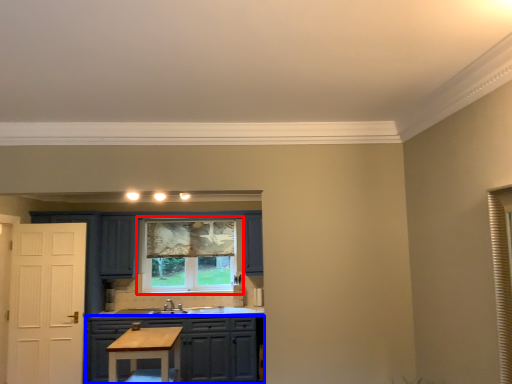
Question: Which of the following is the farthest to the observer, window (highlighted by a red box) or cabinetry (highlighted by a blue box)?

Choices:
 (A) window
 (B) cabinetry

Answer: (A)